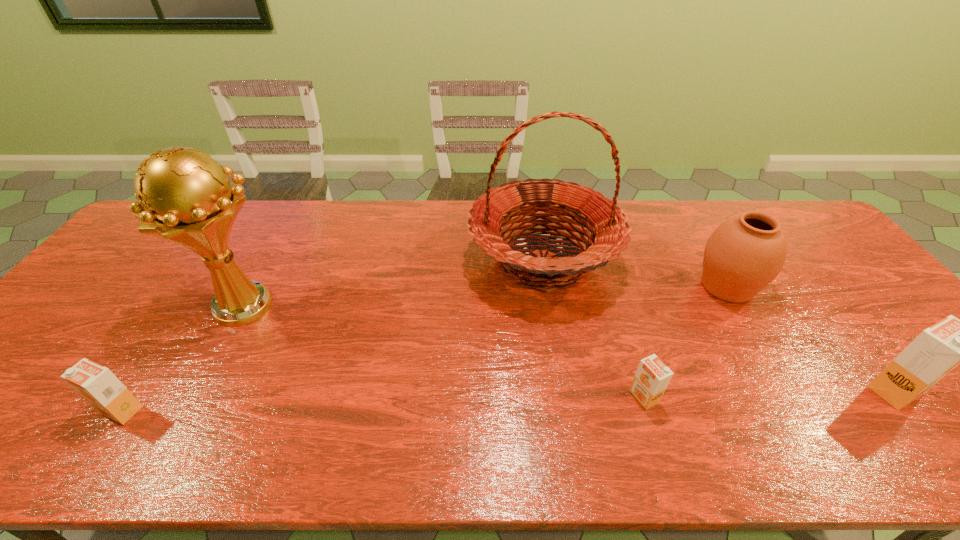
At what (x,y) coordinates should I click in order to perform the action: click on the second shortest object. Please return your answer as a coordinate pair (x, y). Looking at the image, I should click on (95, 383).

Image resolution: width=960 pixels, height=540 pixels. I want to click on the leftmost orange juice, so click(95, 383).

You are a GUI agent. You are given a task and a screenshot of the screen. Output one action in this format:
    pyautogui.click(x=<x>, y=<y>)
    Task: Click on the second orange juice from right to left
    Image resolution: width=960 pixels, height=540 pixels.
    Given the screenshot: What is the action you would take?
    pyautogui.click(x=652, y=377)

Find the location of a particular element. The image size is (960, 540). the shortest orange juice is located at coordinates (652, 377).

I want to click on the rightmost orange juice, so click(937, 350).

Identify the location of the rightmost object. (937, 350).

Locate an element on the screen. This screenshot has height=540, width=960. trophy_cup is located at coordinates (184, 196).

This screenshot has height=540, width=960. Find the location of `urn`. urn is located at coordinates pos(745,253).

Where is `basket`? basket is located at coordinates click(607, 223).

Image resolution: width=960 pixels, height=540 pixels. Find the location of `free space located 0.140m on the right of the fifth tallest object`. free space located 0.140m on the right of the fifth tallest object is located at coordinates (204, 410).